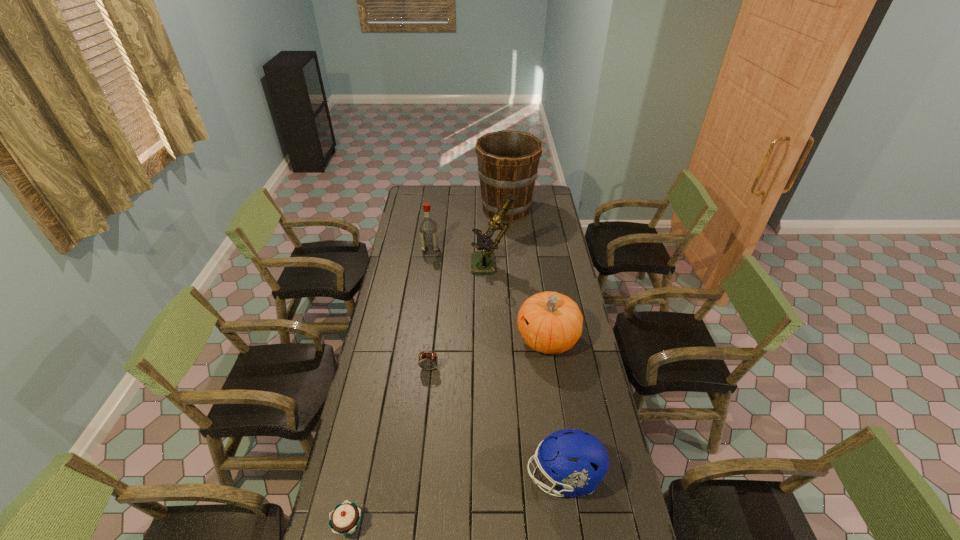
The height and width of the screenshot is (540, 960). Identify the location of free area in between the pumpkin and the liquor. (489, 295).

At what (x,y) coordinates should I click in order to perform the action: click on free point between the microscope and the fifth farthest object. Please return your answer as a coordinate pair (x, y). This screenshot has height=540, width=960. Looking at the image, I should click on (461, 318).

The width and height of the screenshot is (960, 540). I want to click on object that stands as the second closest to the fourth farthest object, so click(427, 361).

Select which object is the sixth closest to the farthest object. Please provide its 2D coordinates. Your answer should be formatted as a tuple, i.e. [(x, y)], where the tuple contains the x and y coordinates of a point satisfying the conditions above.

[(344, 519)]

Identify the location of free space that satisfies the following two spatial constraints: 1. at the eyepiece of the microscope; 2. on the face of the third nearest object. (494, 368).

Find the location of a particular element. The image size is (960, 540). vacant space that satisfies the following two spatial constraints: 1. on the front-facing side of the pumpkin; 2. on the face of the third nearest object is located at coordinates (552, 368).